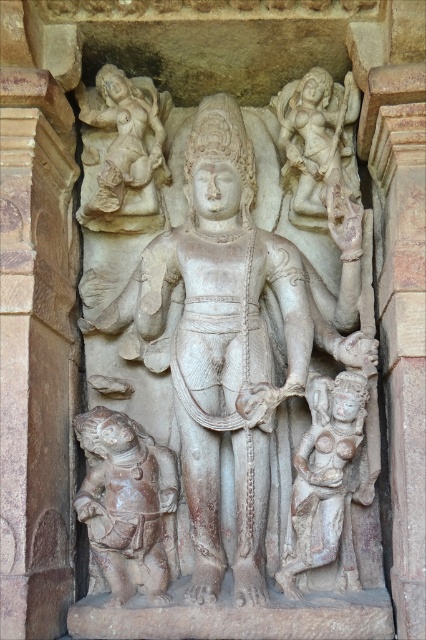
You are an art conservator examining the stone relief sculpture. You need to determine which of the two figures, the brown stone child at lower left or the white stone figure at lower center, requires more support due to its size. Which one should you prioritize?

The brown stone child at lower left has a larger size compared to the white stone figure at lower center, so it should be prioritized for support due to its greater size.

You are standing in front of the stone relief sculpture and want to touch the point at coordinate point (161, 451). Can you reach it without moving closer than 4.5 feet from the sculpture?

The point at coordinate point (161, 451) is 4.71 feet away from the camera, so you cannot reach it without moving closer than 4.5 feet from the sculpture.

You are an art conservator examining the stone relief sculpture. You need to determine the relative heights of the brown stone child at lower left and the white stone figure at lower center to ensure proper mounting. Based on the scene, which of the two is taller?

The white stone figure at lower center is taller than the brown stone child at lower left.